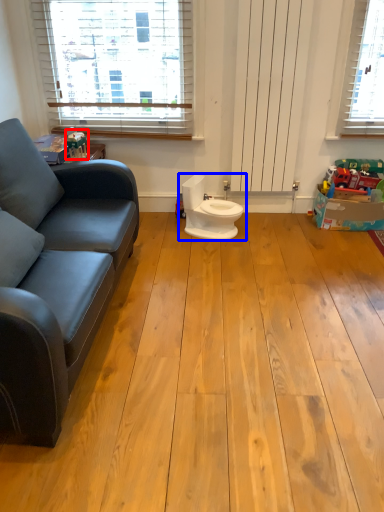
Question: Among these objects, which one is farthest to the camera, toy (highlighted by a red box) or toilet (highlighted by a blue box)?

Choices:
 (A) toy
 (B) toilet

Answer: (B)